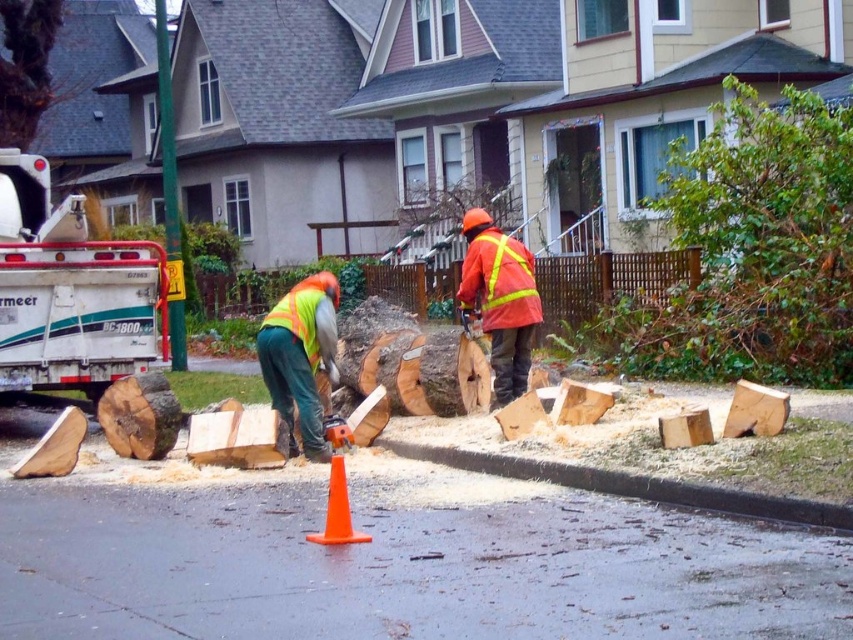
Question: Which object is farther from the camera taking this photo?

Choices:
 (A) orange cone at center
 (B) reflective orange safety vest at center

Answer: (B)

Question: Is orange cone at center to the right of orange plastic traffic cone at center from the viewer's perspective?

Choices:
 (A) yes
 (B) no

Answer: (A)

Question: Is orange cone at center below orange plastic traffic cone at center?

Choices:
 (A) no
 (B) yes

Answer: (B)

Question: Which object appears farthest from the camera in this image?

Choices:
 (A) high-visibility reflective safety vest at center
 (B) orange reflective vest at center
 (C) orange cone at center

Answer: (B)

Question: Which of the following is the closest to the observer?

Choices:
 (A) orange cone at center
 (B) orange reflective vest at center
 (C) high-visibility reflective vest at center

Answer: (A)

Question: Can you confirm if high-visibility reflective vest at center is positioned above high-visibility reflective safety vest at center?

Choices:
 (A) yes
 (B) no

Answer: (B)